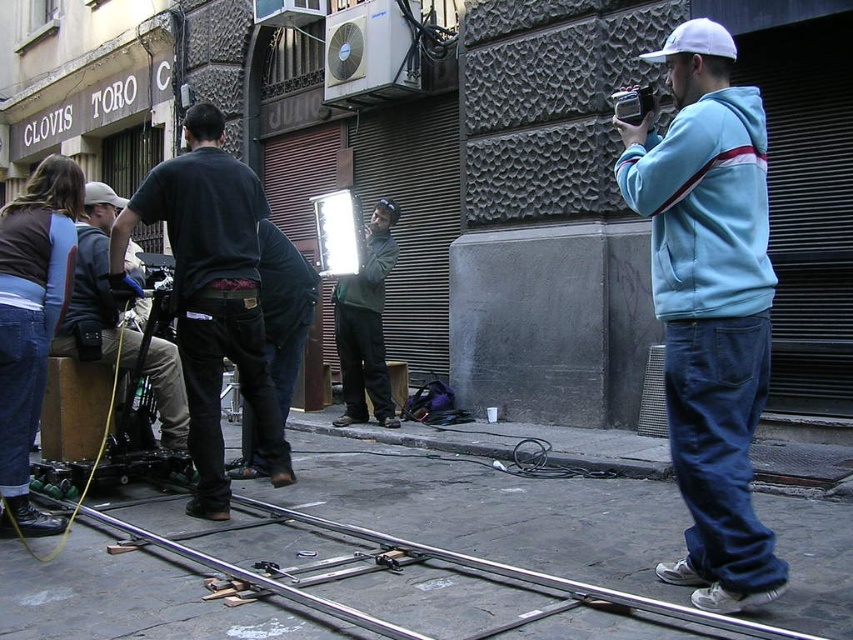
Question: Is matte black camera at left above green fabric jacket at center?

Choices:
 (A) no
 (B) yes

Answer: (A)

Question: Which object is farther from the camera taking this photo?

Choices:
 (A) green fabric jacket at center
 (B) black plastic video camera at right
 (C) black denim jeans at left

Answer: (A)

Question: Is black denim jeans at left further to camera compared to black plastic video camera at right?

Choices:
 (A) no
 (B) yes

Answer: (A)

Question: Estimate the real-world distances between objects in this image. Which object is closer to the light blue hoodie at right?

Choices:
 (A) green fabric jacket at center
 (B) matte black camera at left

Answer: (B)

Question: Among these points, which one is nearest to the camera?

Choices:
 (A) (209, 339)
 (B) (439, 515)
 (C) (125, 262)

Answer: (A)

Question: Is light blue hoodie at right wider than black plastic video camera at right?

Choices:
 (A) yes
 (B) no

Answer: (A)